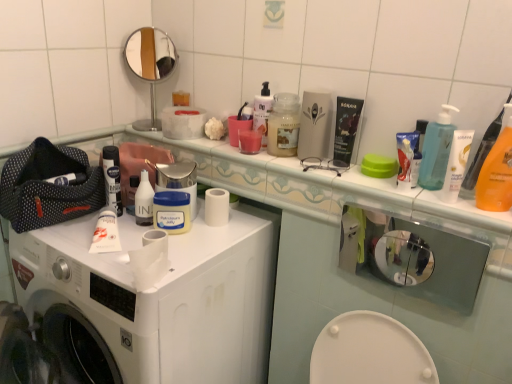
The width and height of the screenshot is (512, 384). I want to click on space that is in front of white matte jar at center, which is counted as the second mouthwash, starting from the left, so click(x=167, y=256).